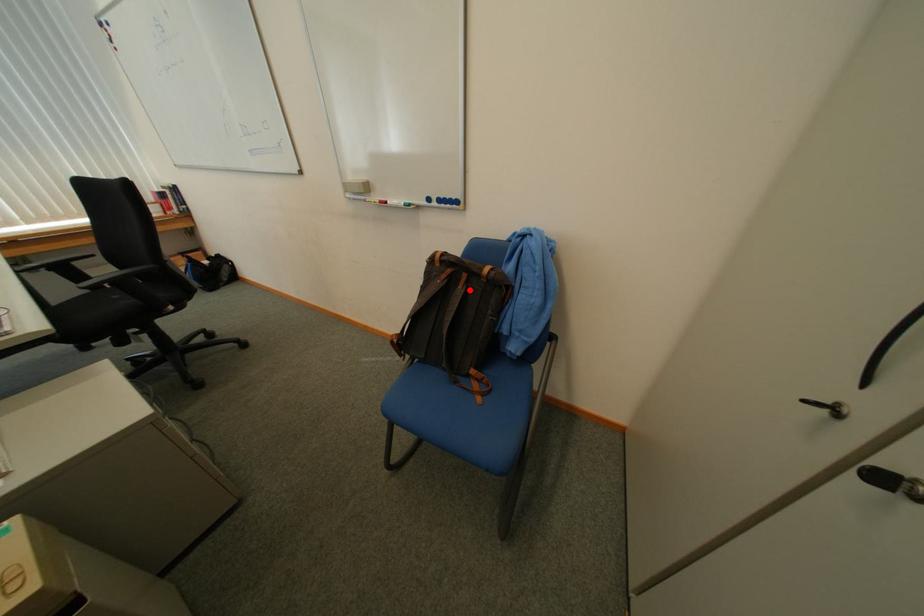
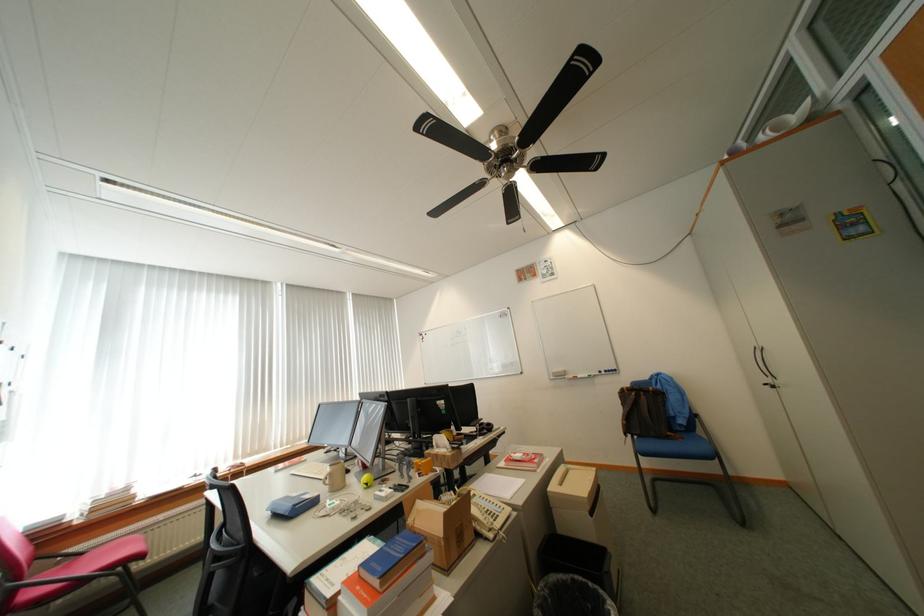
Question: A red point is marked in image1. In image2, is the corresponding 3D point closer to the camera or farther? Reply with the corresponding letter.

Choices:
 (A) The corresponding 3D point is closer.
 (B) The corresponding 3D point is farther.

Answer: (B)